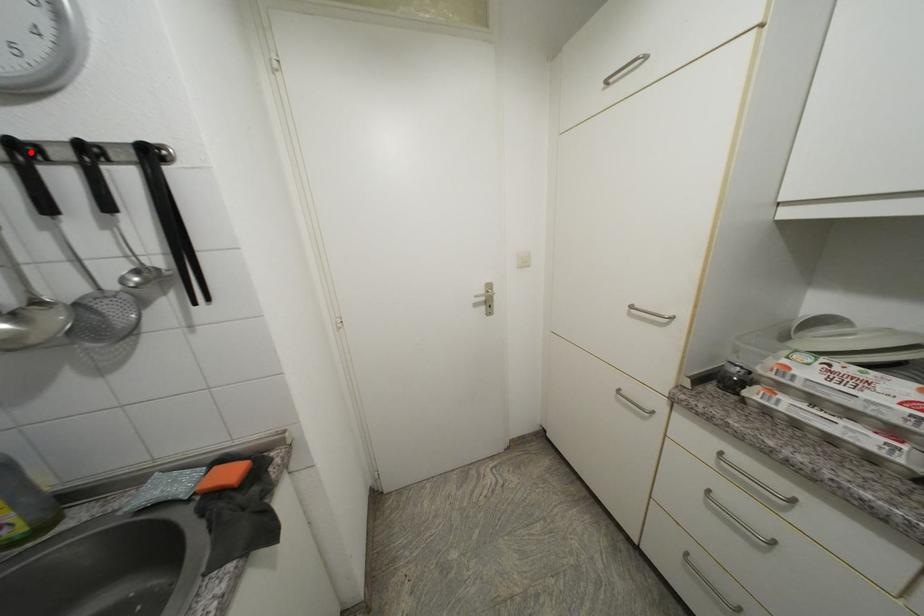
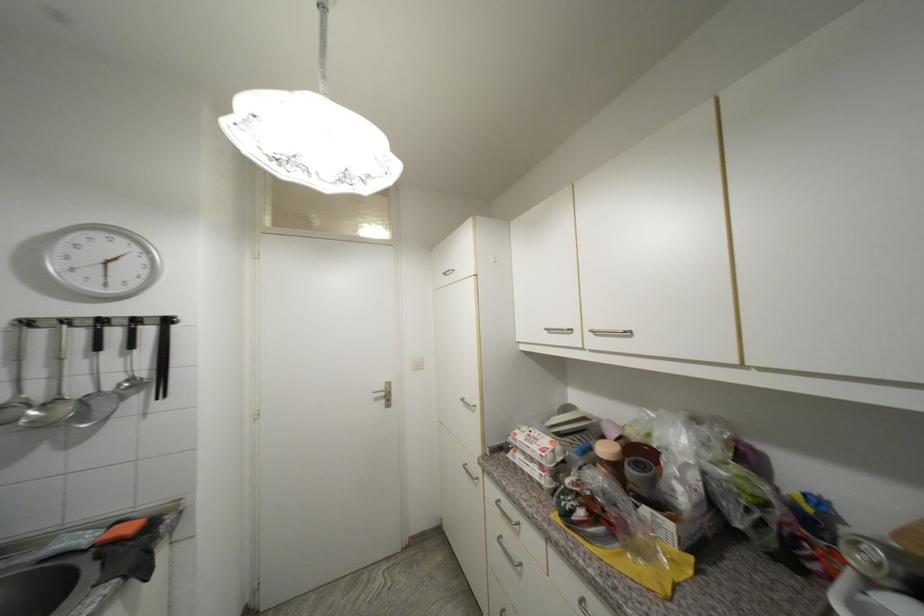
Locate, in the second image, the point that corresponds to the highlighted location in the first image.

(108, 323)